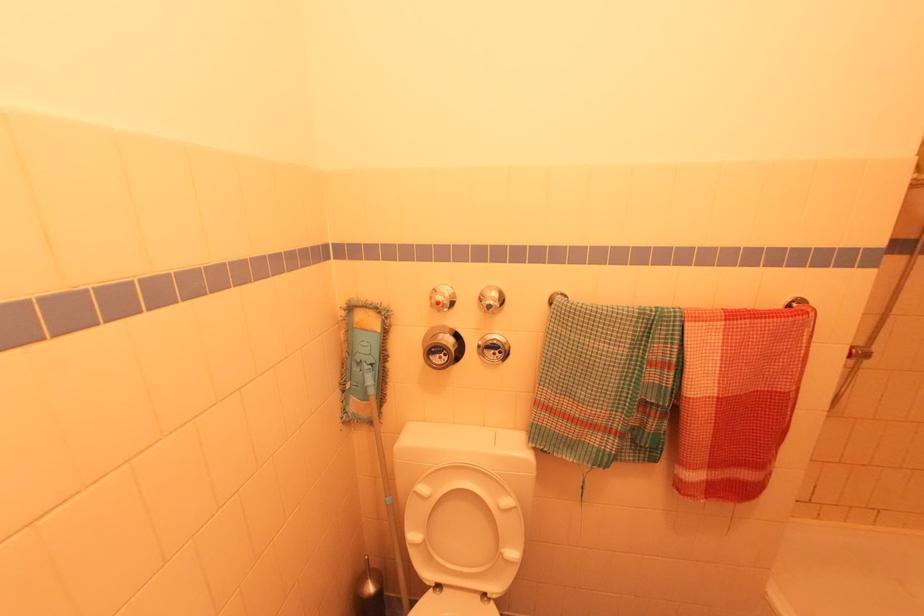
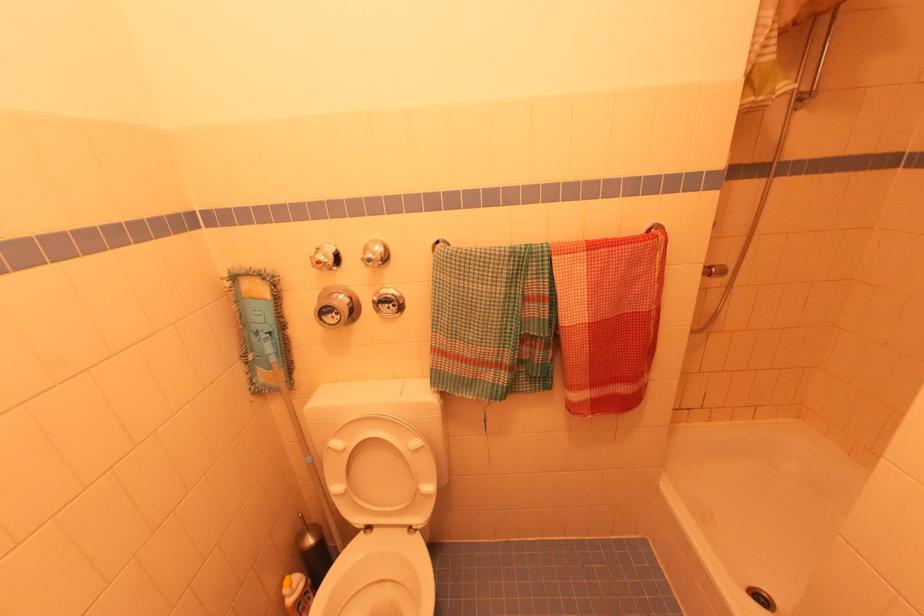
Where in the second image is the point corresponding to pixel 562 306 from the first image?

(441, 253)